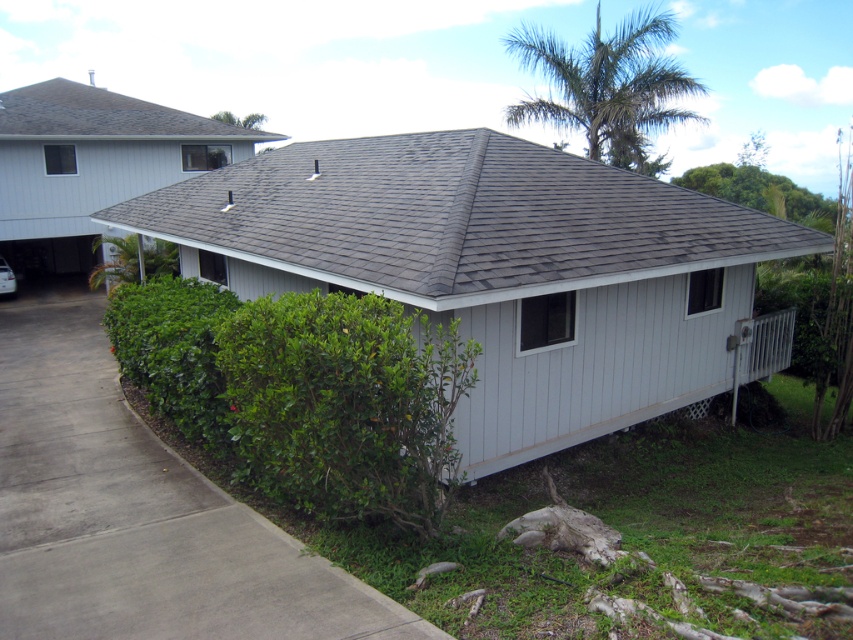
Question: Where is gray shingles at center located in relation to gray concrete driveway at lower left in the image?

Choices:
 (A) right
 (B) left

Answer: (A)

Question: Which object is the farthest from the gray concrete driveway at lower left?

Choices:
 (A) gray shingles at center
 (B) gray shingles at upper left

Answer: (B)

Question: Does gray concrete driveway at lower left have a larger size compared to gray shingles at upper left?

Choices:
 (A) yes
 (B) no

Answer: (B)

Question: Which of the following is the closest to the observer?

Choices:
 (A) gray shingles at center
 (B) gray shingles at upper left

Answer: (A)

Question: Among these points, which one is farthest from the camera?

Choices:
 (A) (489, 145)
 (B) (367, 608)

Answer: (A)

Question: Is gray shingles at center to the left of gray shingles at upper left from the viewer's perspective?

Choices:
 (A) no
 (B) yes

Answer: (A)